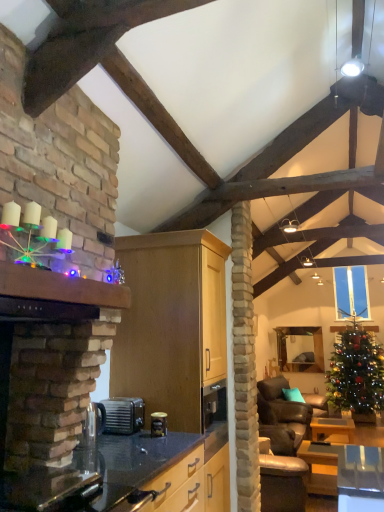
Question: Does wooden mantle at upper left appear on the left side of clear glass carafe at lower left, which ranks as the 1th appliance in left-to-right order?

Choices:
 (A) no
 (B) yes

Answer: (B)

Question: Is wooden mantle at upper left facing away from clear glass carafe at lower left, which is the first appliance from front to back?

Choices:
 (A) yes
 (B) no

Answer: (B)

Question: From a real-world perspective, is wooden mantle at upper left on top of clear glass carafe at lower left, the third appliance when ordered from back to front?

Choices:
 (A) no
 (B) yes

Answer: (B)

Question: Does wooden mantle at upper left have a greater width compared to clear glass carafe at lower left, the third appliance when ordered from back to front?

Choices:
 (A) yes
 (B) no

Answer: (A)

Question: Does wooden mantle at upper left turn towards clear glass carafe at lower left, which is the first appliance from front to back?

Choices:
 (A) yes
 (B) no

Answer: (B)

Question: Considering the positions of leather couch at lower right and wooden table at lower right, which is the second table in front-to-back order, in the image, is leather couch at lower right wider or thinner than wooden table at lower right, which is the second table in front-to-back order,?

Choices:
 (A) wide
 (B) thin

Answer: (A)

Question: Is point (271, 396) closer or farther from the camera than point (337, 423)?

Choices:
 (A) farther
 (B) closer

Answer: (A)

Question: Considering the positions of leather couch at lower right and wooden table at lower right, which ranks as the 1th table in back-to-front order, in the image, is leather couch at lower right taller or shorter than wooden table at lower right, which ranks as the 1th table in back-to-front order,?

Choices:
 (A) short
 (B) tall

Answer: (B)

Question: Is leather couch at lower right bigger or smaller than wooden table at lower right, which ranks as the 1th table in back-to-front order?

Choices:
 (A) big
 (B) small

Answer: (A)

Question: From a real-world perspective, relative to clear glass window at upper center, is black granite countertop at center vertically above or below?

Choices:
 (A) above
 (B) below

Answer: (B)

Question: In the image, is black granite countertop at center positioned in front of or behind clear glass window at upper center?

Choices:
 (A) behind
 (B) front

Answer: (B)

Question: From the image's perspective, relative to clear glass window at upper center, is black granite countertop at center above or below?

Choices:
 (A) below
 (B) above

Answer: (A)

Question: Based on their positions, is black granite countertop at center located to the left or right of clear glass window at upper center?

Choices:
 (A) right
 (B) left

Answer: (B)

Question: In terms of width, does wooden table at lower right, which ranks as the 1th table in back-to-front order, look wider or thinner when compared to black granite countertop at center?

Choices:
 (A) wide
 (B) thin

Answer: (B)

Question: Based on their sizes in the image, would you say wooden table at lower right, which ranks as the 1th table in back-to-front order, is bigger or smaller than black granite countertop at center?

Choices:
 (A) small
 (B) big

Answer: (A)